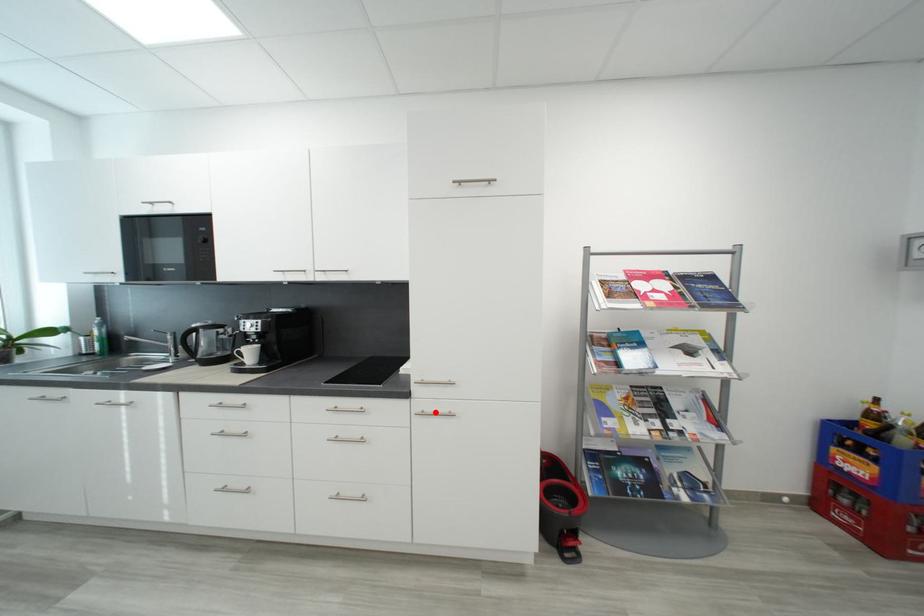
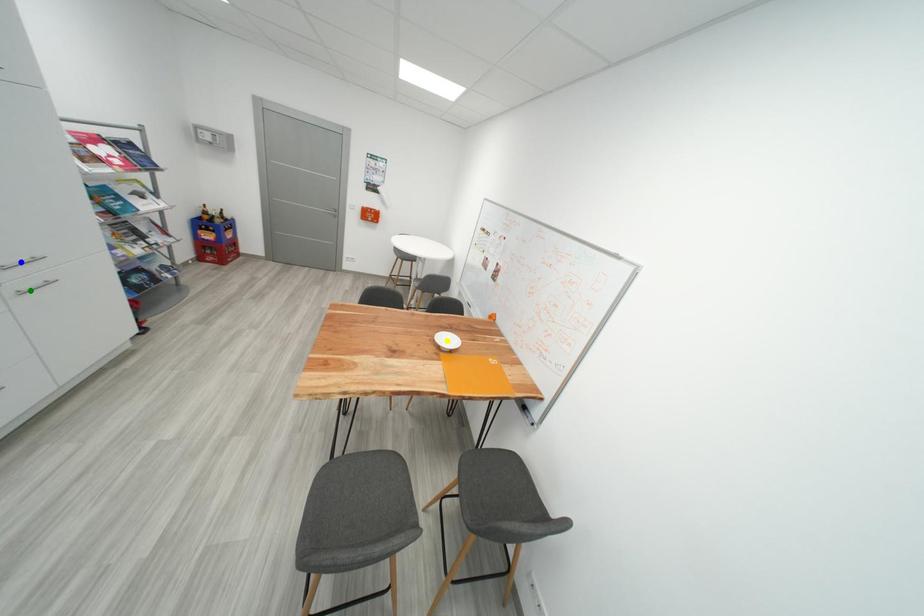
Question: I am providing you with two images of the same scene from different viewpoints. A red point is marked on the first image. You are given multiple points on the second image. Which point in image 2 is actually the same real-world point as the red point in image 1?

Choices:
 (A) green point
 (B) yellow point
 (C) blue point

Answer: (A)